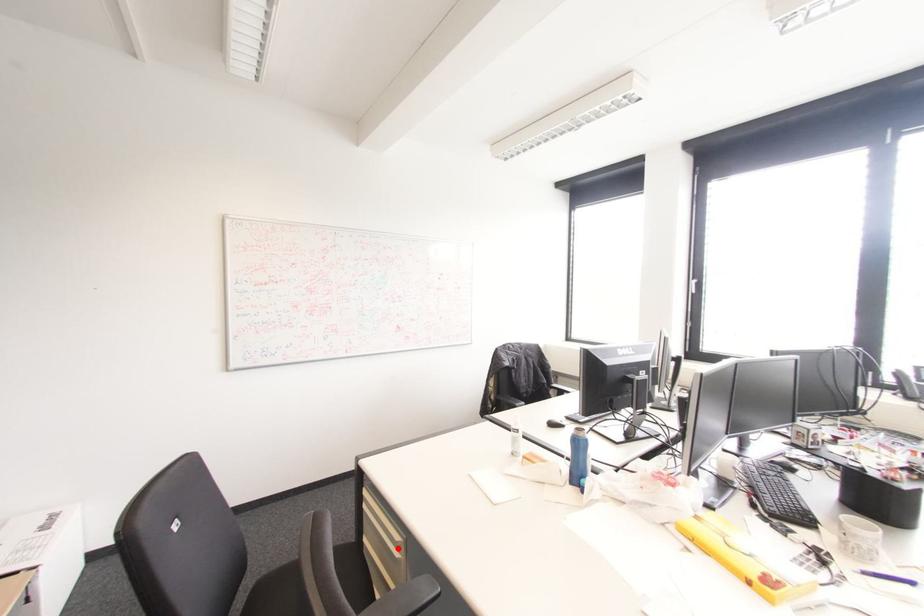
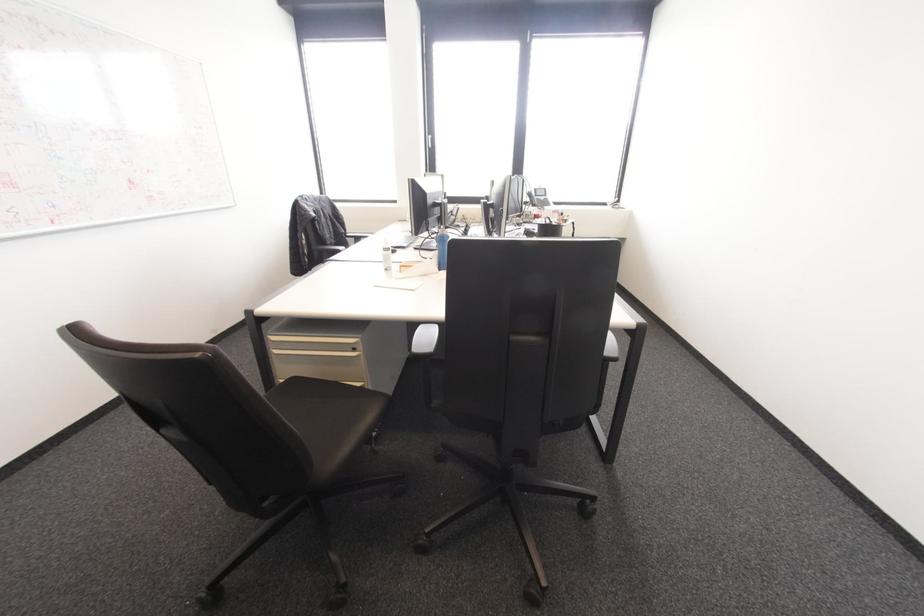
In the second image, find the point that corresponds to the highlighted location in the first image.

(354, 349)